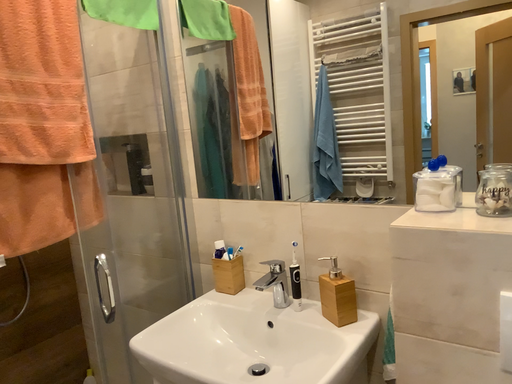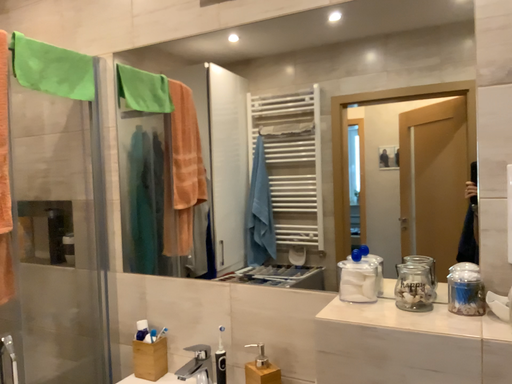
Question: Which way did the camera rotate in the video?

Choices:
 (A) rotated right
 (B) rotated left

Answer: (A)